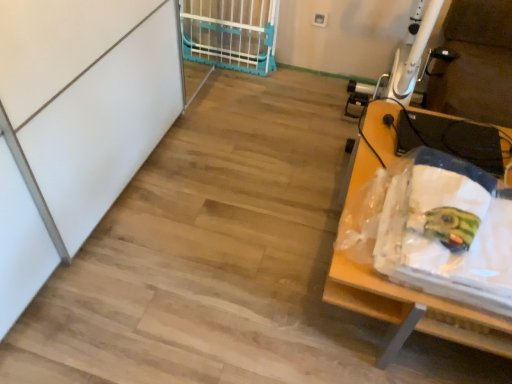
This screenshot has height=384, width=512. What do you see at coordinates (406, 309) in the screenshot?
I see `wooden table at right` at bounding box center [406, 309].

Where is `wooden table at right`? wooden table at right is located at coordinates (406, 309).

What do you see at coordinates (230, 33) in the screenshot?
I see `blue plastic gate at upper center` at bounding box center [230, 33].

This screenshot has height=384, width=512. I want to click on blue plastic gate at upper center, so click(230, 33).

You are a GUI agent. You are given a task and a screenshot of the screen. Output one action in this format:
    pyautogui.click(x=<x>, y=<y>)
    Task: Click on the wooden table at right
    This screenshot has height=384, width=512.
    Given the screenshot: What is the action you would take?
    pos(406,309)

Can you confirm if blue plastic gate at upper center is positioned to the right of wooden table at right?

In fact, blue plastic gate at upper center is to the left of wooden table at right.

Is blue plastic gate at upper center positioned in front of wooden table at right?

No, it is not.

Is point (250, 22) positioned behind point (385, 320)?

Yes, it is behind point (385, 320).

From the image's perspective, which is below, blue plastic gate at upper center or wooden table at right?

wooden table at right.

From a real-world perspective, relative to wooden table at right, is blue plastic gate at upper center vertically above or below?

In terms of real-world spatial position, blue plastic gate at upper center is above wooden table at right.

Is blue plastic gate at upper center wider than wooden table at right?

Incorrect, the width of blue plastic gate at upper center does not surpass that of wooden table at right.

In terms of height, does blue plastic gate at upper center look taller or shorter compared to wooden table at right?

Clearly, blue plastic gate at upper center is taller compared to wooden table at right.

Considering the sizes of blue plastic gate at upper center and wooden table at right in the image, is blue plastic gate at upper center bigger or smaller than wooden table at right?

Considering their sizes, blue plastic gate at upper center takes up less space than wooden table at right.

Is wooden table at right surrounded by blue plastic gate at upper center?

Actually, wooden table at right is outside blue plastic gate at upper center.

Is blue plastic gate at upper center directly adjacent to wooden table at right?

No, blue plastic gate at upper center is not making contact with wooden table at right.

Could you tell me if blue plastic gate at upper center is turned towards wooden table at right?

No, blue plastic gate at upper center is not oriented towards wooden table at right.

How far apart are blue plastic gate at upper center and wooden table at right?

blue plastic gate at upper center and wooden table at right are 6.04 feet apart.

Find the location of a particular element. furniture below the blue plastic gate at upper center (from a real-world perspective) is located at coordinates (406, 309).

Considering the positions of objects wooden table at right and blue plastic gate at upper center in the image provided, who is more to the left, wooden table at right or blue plastic gate at upper center?

From the viewer's perspective, blue plastic gate at upper center appears more on the left side.

In the scene shown: Is wooden table at right positioned before blue plastic gate at upper center?

Yes, the depth of wooden table at right is less than that of blue plastic gate at upper center.

Which is behind, point (347, 289) or point (270, 28)?

The point (270, 28) is farther from the camera.

From the image's perspective, is wooden table at right located above blue plastic gate at upper center?

No, from the image's perspective, wooden table at right is not over blue plastic gate at upper center.

Consider the image. From a real-world perspective, is wooden table at right physically above blue plastic gate at upper center?

No.

In terms of width, does wooden table at right look wider or thinner when compared to blue plastic gate at upper center?

Considering their sizes, wooden table at right looks broader than blue plastic gate at upper center.

Considering the sizes of wooden table at right and blue plastic gate at upper center in the image, is wooden table at right taller or shorter than blue plastic gate at upper center?

In the image, wooden table at right appears to be shorter than blue plastic gate at upper center.

Which of these two, wooden table at right or blue plastic gate at upper center, is smaller?

blue plastic gate at upper center is smaller.

Is blue plastic gate at upper center a part of wooden table at right?

That's incorrect, blue plastic gate at upper center is not inside wooden table at right.

Is wooden table at right not close to blue plastic gate at upper center?

wooden table at right is positioned a significant distance from blue plastic gate at upper center.

Is wooden table at right facing towards blue plastic gate at upper center?

No, wooden table at right does not turn towards blue plastic gate at upper center.

From the picture: How different are the orientations of wooden table at right and blue plastic gate at upper center in degrees?

91.8 degrees separate the facing orientations of wooden table at right and blue plastic gate at upper center.

Find the location of a particular element. furniture located on the right of blue plastic gate at upper center is located at coordinates (406, 309).

You are a GUI agent. You are given a task and a screenshot of the screen. Output one action in this format:
    pyautogui.click(x=<x>, y=<y>)
    Task: Click on the furniture beneath the blue plastic gate at upper center (from a real-world perspective)
    The width and height of the screenshot is (512, 384).
    Given the screenshot: What is the action you would take?
    pyautogui.click(x=406, y=309)

Locate an element on the screen. This screenshot has height=384, width=512. furniture located in front of the blue plastic gate at upper center is located at coordinates (406, 309).